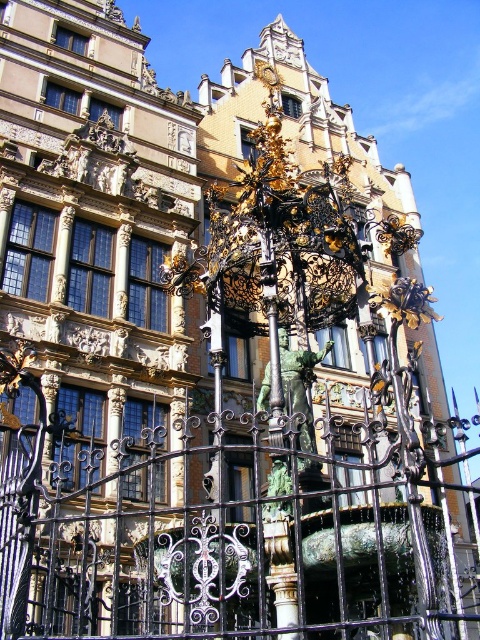
Question: Can you confirm if black wrought iron fence at center is positioned above green patina statue at center?

Choices:
 (A) no
 (B) yes

Answer: (A)

Question: Which of the following is the farthest from the observer?

Choices:
 (A) (224, 492)
 (B) (288, 353)

Answer: (B)

Question: Which point is closer to the camera?

Choices:
 (A) black wrought iron fence at center
 (B) green patina statue at center

Answer: (A)

Question: Is black wrought iron fence at center positioned before green patina statue at center?

Choices:
 (A) yes
 (B) no

Answer: (A)

Question: Can you confirm if black wrought iron fence at center is smaller than green patina statue at center?

Choices:
 (A) no
 (B) yes

Answer: (A)

Question: Among these points, which one is farthest from the camera?

Choices:
 (A) 288,412
 (B) 83,476

Answer: (B)